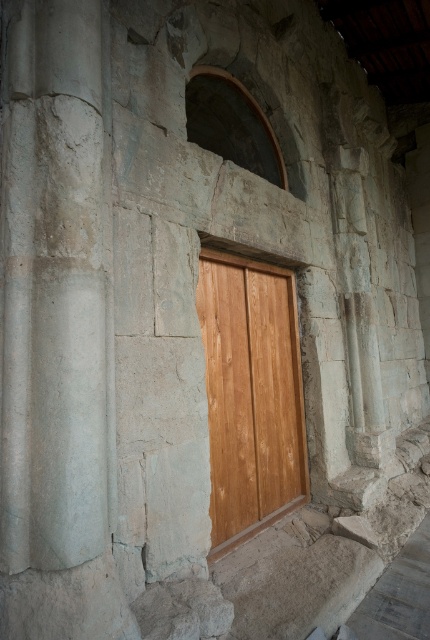
Where is `smooth concrete column at left`? This screenshot has width=430, height=640. smooth concrete column at left is located at coordinates (54, 291).

Which is more to the right, smooth concrete column at left or light brown wood door at center?

light brown wood door at center is more to the right.

Between point (43, 502) and point (217, 305), which one is positioned behind?

Positioned behind is point (217, 305).

At what (x,y) coordinates should I click in order to perform the action: click on smooth concrete column at left. Please return your answer as a coordinate pair (x, y). The height and width of the screenshot is (640, 430). Looking at the image, I should click on (54, 291).